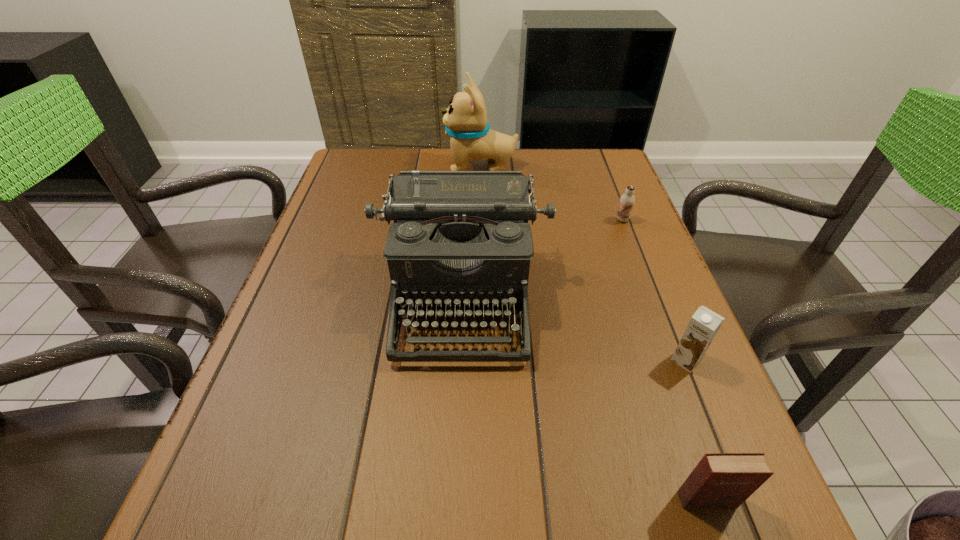
The image size is (960, 540). Find the location of `vacant position in the image that satisfies the following two spatial constraints: 1. on the typing side of the second tallest object; 2. on the left side of the nearer chocolate milk`. vacant position in the image that satisfies the following two spatial constraints: 1. on the typing side of the second tallest object; 2. on the left side of the nearer chocolate milk is located at coordinates (459, 360).